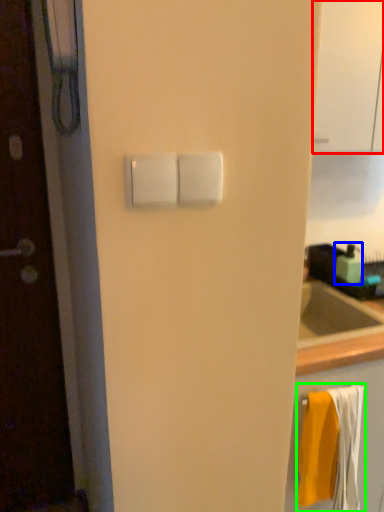
Question: Considering the real-world distances, which object is farthest from glass door (highlighted by a red box)? soap dispenser (highlighted by a blue box) or bath towel (highlighted by a green box)?

Choices:
 (A) soap dispenser
 (B) bath towel

Answer: (B)